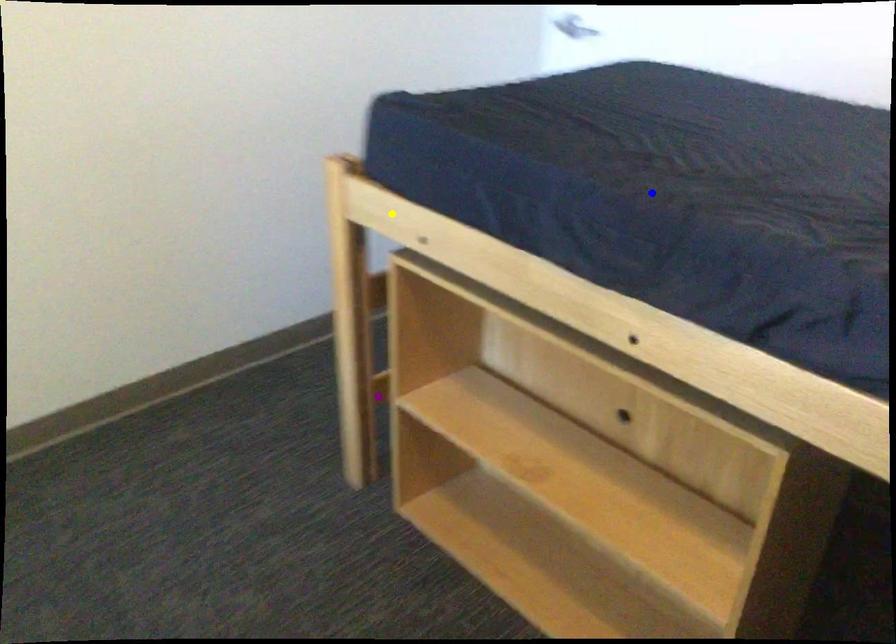
Order these from nearest to farthest:
1. blue point
2. purple point
3. yellow point

blue point, yellow point, purple point